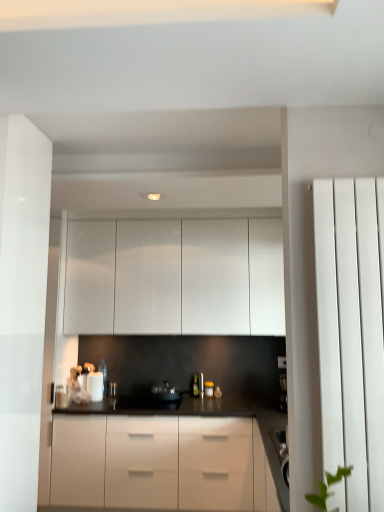
The image size is (384, 512). In order to click on blank area to the left of matte silver faucet at center in this screenshot , I will do `click(187, 399)`.